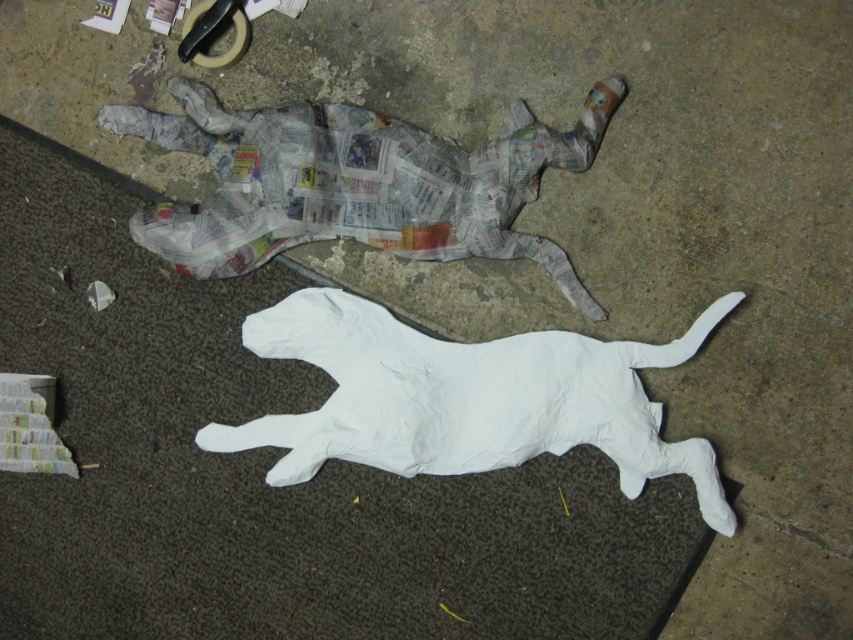
Between point (468, 468) and point (172, 227), which one is positioned in front?

Positioned in front is point (468, 468).

Is white paper dog at center further to camera compared to newspaper-covered dog at upper center?

That is False.

Where is `white paper dog at center`? This screenshot has height=640, width=853. white paper dog at center is located at coordinates coord(467,397).

The height and width of the screenshot is (640, 853). Find the location of `newspaper-covered dog at upper center`. newspaper-covered dog at upper center is located at coordinates (357, 182).

Image resolution: width=853 pixels, height=640 pixels. What do you see at coordinates (357, 182) in the screenshot?
I see `newspaper-covered dog at upper center` at bounding box center [357, 182].

The height and width of the screenshot is (640, 853). I want to click on newspaper-covered dog at upper center, so click(x=357, y=182).

Is white paper dog at center wider than matte black tape at upper center?

Yes.

Is white paper dog at center above matte black tape at upper center?

Incorrect, white paper dog at center is not positioned above matte black tape at upper center.

Does point (459, 449) come farther from viewer compared to point (196, 8)?

That is False.

At what (x,y) coordinates should I click in order to perform the action: click on white paper dog at center. Please return your answer as a coordinate pair (x, y). The width and height of the screenshot is (853, 640). Looking at the image, I should click on (467, 397).